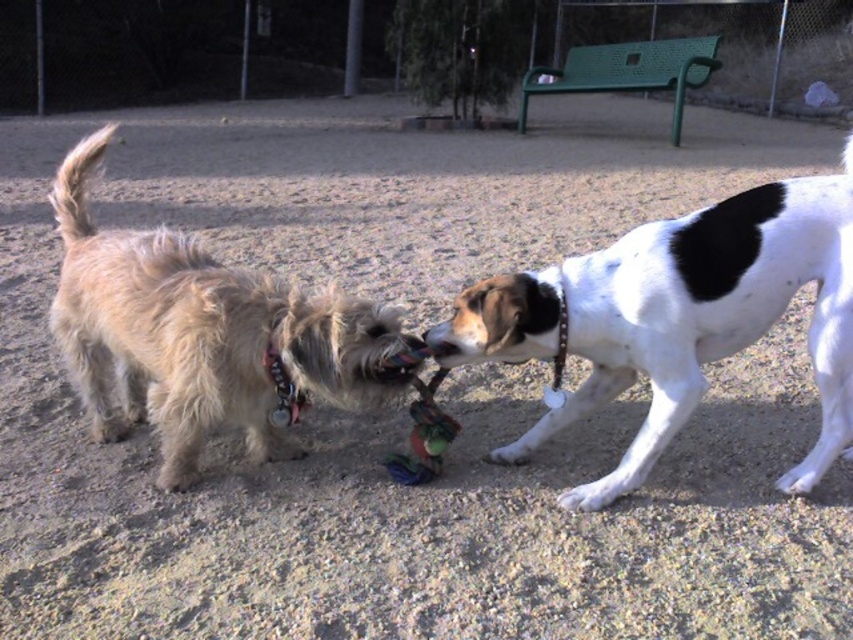
Who is taller, white smooth dog at right or light brown fur at left?

With more height is light brown fur at left.

Is white smooth dog at right closer to camera compared to light brown fur at left?

That is False.

Identify the location of white smooth dog at right. The height and width of the screenshot is (640, 853). (676, 317).

At what (x,y) coordinates should I click in order to perform the action: click on white smooth dog at right. Please return your answer as a coordinate pair (x, y). The height and width of the screenshot is (640, 853). Looking at the image, I should click on (676, 317).